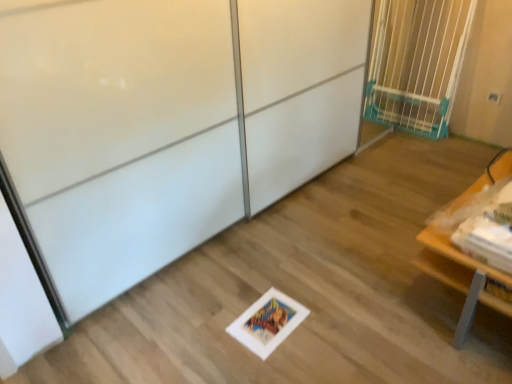
Question: Is wooden table at lower right to the left or to the right of white glossy screen door at center in the image?

Choices:
 (A) right
 (B) left

Answer: (A)

Question: Is wooden table at lower right taller or shorter than white glossy screen door at center?

Choices:
 (A) tall
 (B) short

Answer: (B)

Question: Which is farther from the wooden table at lower right?

Choices:
 (A) blue plastic gate at upper right
 (B) white glossy screen door at center

Answer: (A)

Question: Based on their relative distances, which object is farther from the blue plastic gate at upper right?

Choices:
 (A) white glossy screen door at center
 (B) wooden table at lower right

Answer: (A)